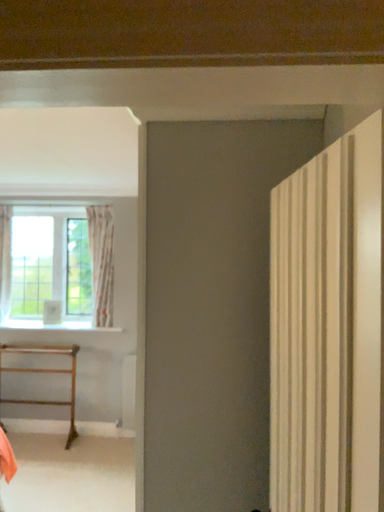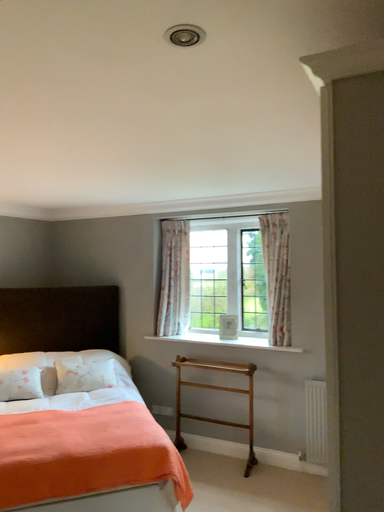
Question: Which way did the camera rotate in the video?

Choices:
 (A) rotated left
 (B) rotated right

Answer: (A)